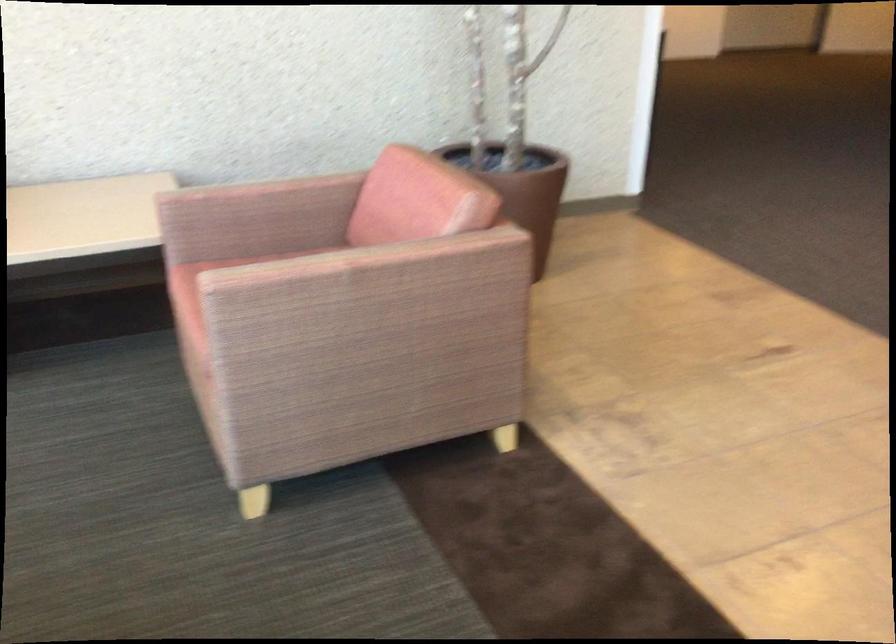
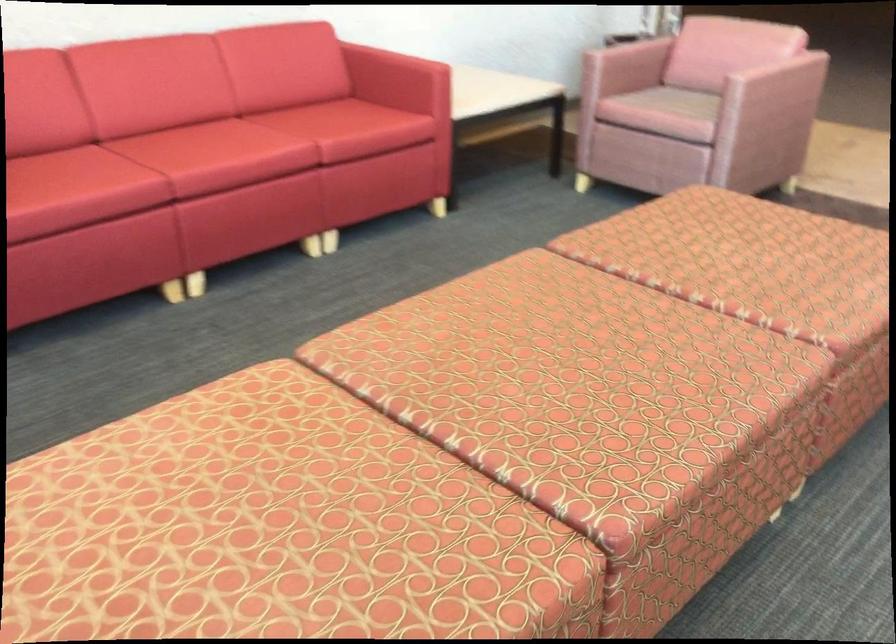
The point at (383, 303) is marked in the first image. Where is the corresponding point in the second image?

(773, 90)